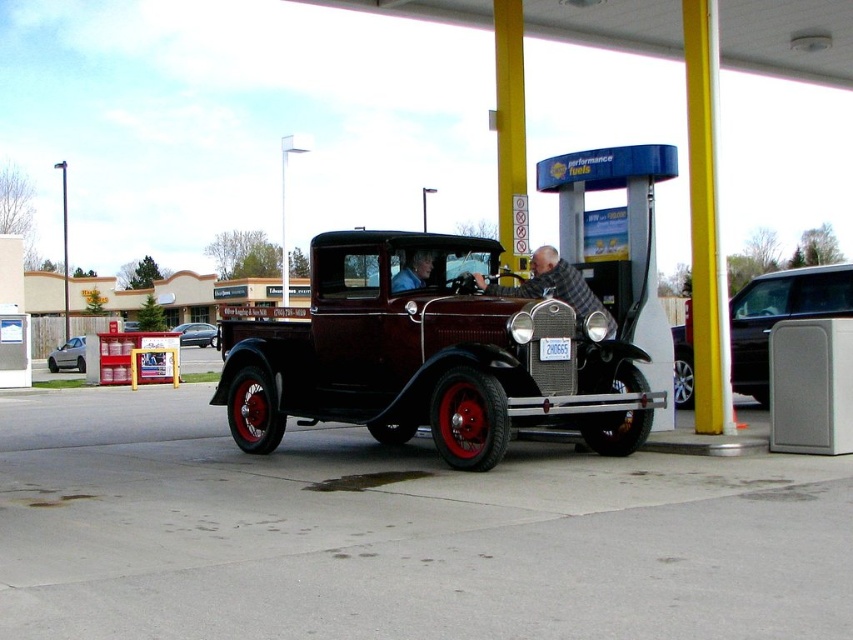
You are a customer at the gas station and see two items hanging on a rack between the plaid wool sweater at center and the matte black shirt at center. Which item is closer to the right side of the rack?

The plaid wool sweater at center is to the right of the matte black shirt at center, so it is closer to the right side of the rack.

You are a delivery driver who needs to back up your metallic silver van at right into a parking spot that is 10 meters away from your current position. Can you safely back up without hitting anything?

The distance between the metallic silver van at right and the camera is 9.37 meters. Since the parking spot is 10 meters away, there is enough space to safely back up without hitting anything.